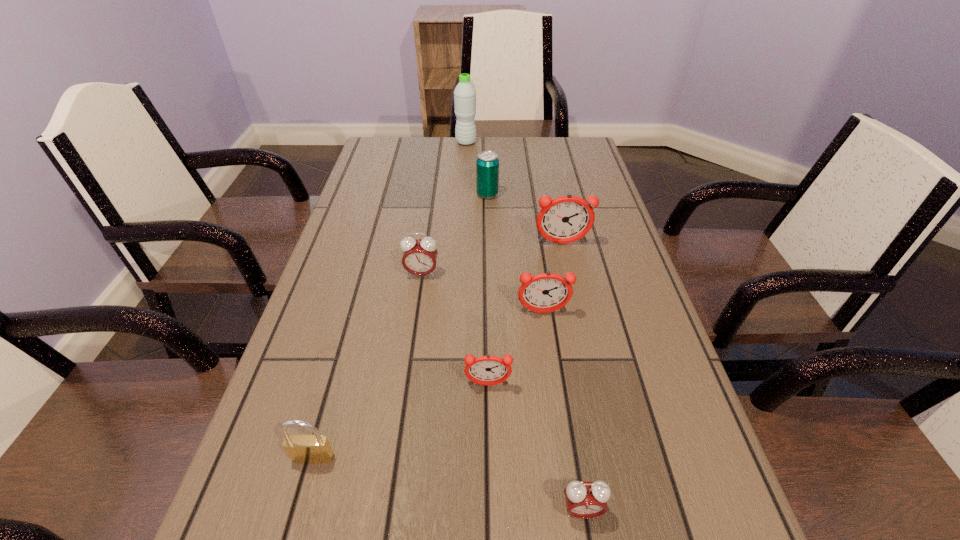
Locate an element on the screen. free space that is in between the padlock and the water bottle is located at coordinates (390, 300).

What are the coordinates of `empty space that is in between the farthest reddish-pink alarm clock and the leftmost object` in the screenshot? It's located at (438, 350).

This screenshot has height=540, width=960. I want to click on vacant area that lies between the brass padlock and the third farthest object, so click(x=438, y=350).

Where is `free space between the third farthest object and the right pink alarm clock`? This screenshot has width=960, height=540. free space between the third farthest object and the right pink alarm clock is located at coordinates (572, 377).

Identify the location of free space between the seventh farthest object and the beer can. click(x=400, y=326).

In order to click on vacant space that's between the leftmost object and the fifth farthest object in this screenshot , I will do `click(428, 385)`.

Locate an element on the screen. vacant region between the teal beer can and the padlock is located at coordinates (400, 326).

The height and width of the screenshot is (540, 960). I want to click on free spot between the fourth farthest object and the third farthest object, so click(x=492, y=259).

At what (x,y) coordinates should I click in order to perform the action: click on the closest object to the beer can. Please return your answer as a coordinate pair (x, y). Looking at the image, I should click on (566, 219).

Where is `object that is the second closest to the second nearest object`? The height and width of the screenshot is (540, 960). object that is the second closest to the second nearest object is located at coordinates (584, 500).